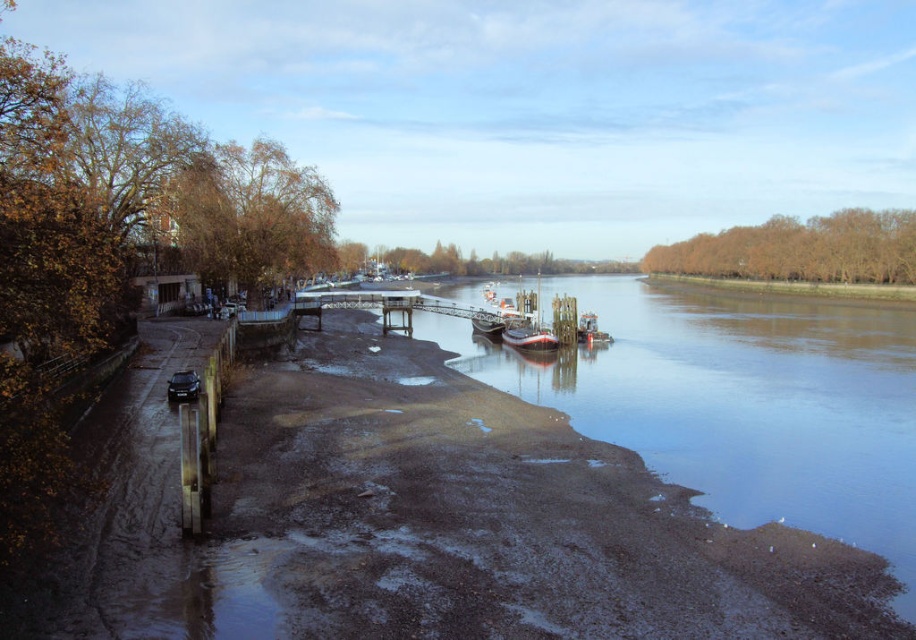
Does white wooden boat at center appear under white glossy boat at center?

No.

Who is more forward, (x=504, y=340) or (x=509, y=342)?

Positioned in front is point (x=509, y=342).

What are the coordinates of `white wooden boat at center` in the screenshot? It's located at (529, 324).

I want to click on white wooden boat at center, so click(x=529, y=324).

Is point (413, 316) closer to camera compared to point (529, 326)?

No, (413, 316) is behind (529, 326).

Who is positioned more to the left, brown matte river at center or white glossy boat at center?

white glossy boat at center is more to the left.

Is point (679, 401) positioned before point (551, 342)?

Yes, it is in front of point (551, 342).

This screenshot has height=640, width=916. Identify the location of brown matte river at center. (737, 401).

Who is more forward, (849, 541) or (544, 342)?

Positioned in front is point (849, 541).

Between point (664, 378) and point (533, 348), which one is positioned in front?

Point (664, 378) is more forward.

At what (x,y) coordinates should I click in order to perform the action: click on brown matte river at center. Please return your answer as a coordinate pair (x, y). Looking at the image, I should click on (x=737, y=401).